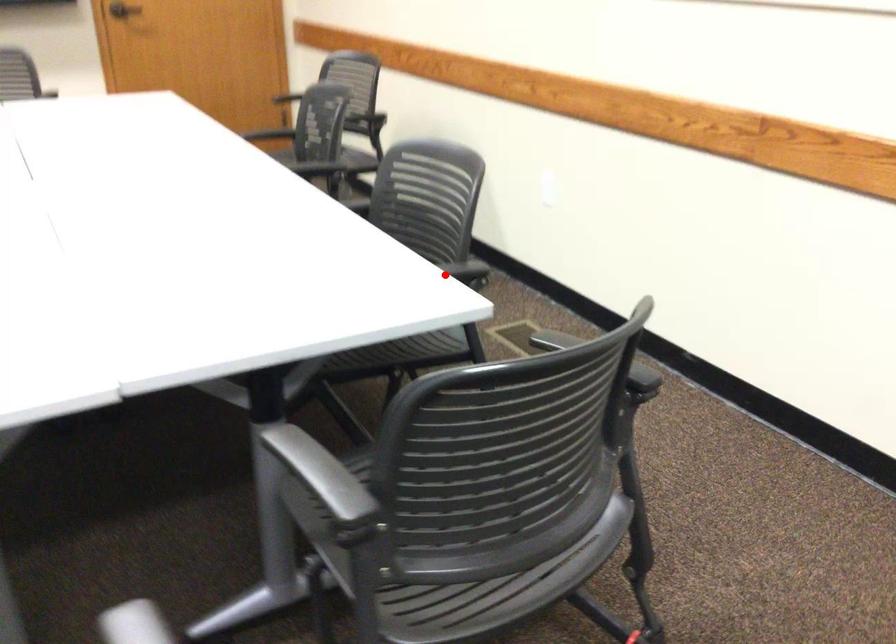
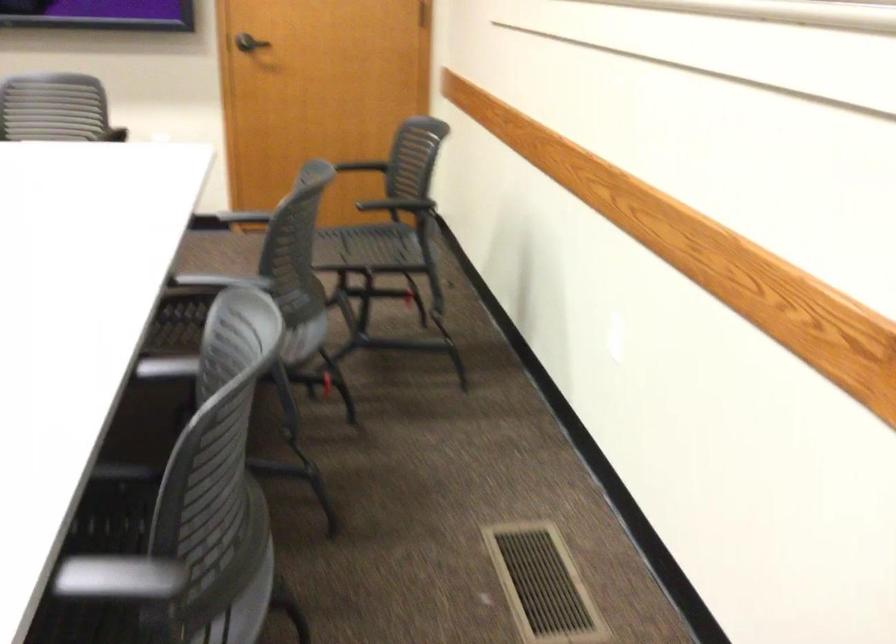
Question: A red point is marked in image1. In image2, is the corresponding 3D point closer to the camera or farther? Reply with the corresponding letter.

Choices:
 (A) The corresponding 3D point is closer.
 (B) The corresponding 3D point is farther.

Answer: (A)